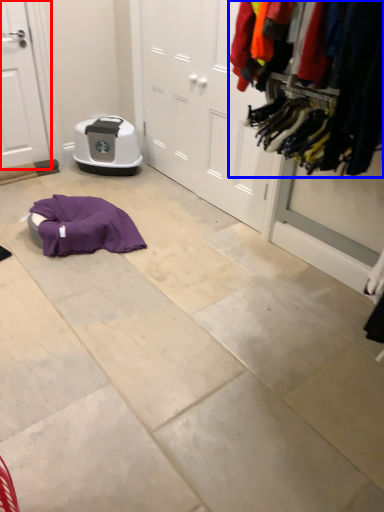
Question: Which object appears closest to the camera in this image, door (highlighted by a red box) or closet (highlighted by a blue box)?

Choices:
 (A) door
 (B) closet

Answer: (B)